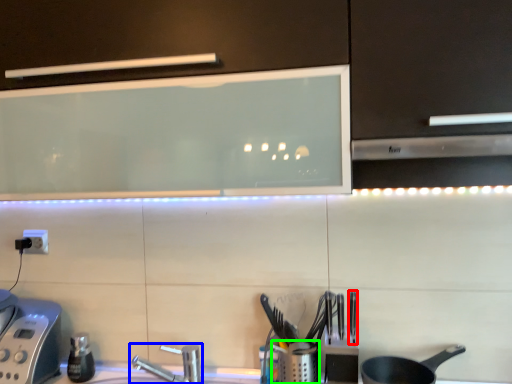
Question: Which object is the closest to the silverware (highlighted by a red box)? Choose among these: tap (highlighted by a blue box) or appliance (highlighted by a green box).

Choices:
 (A) tap
 (B) appliance

Answer: (B)